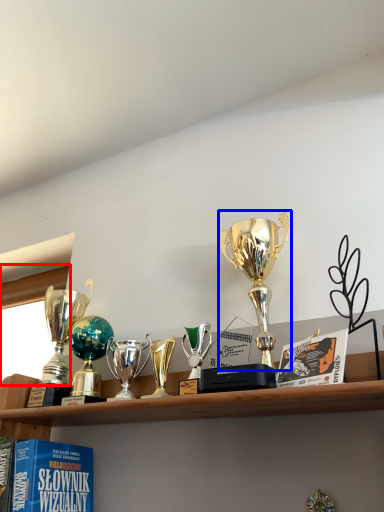
Question: Which point is closer to the camera, window screen (highlighted by a red box) or trophy (highlighted by a blue box)?

Choices:
 (A) window screen
 (B) trophy

Answer: (B)